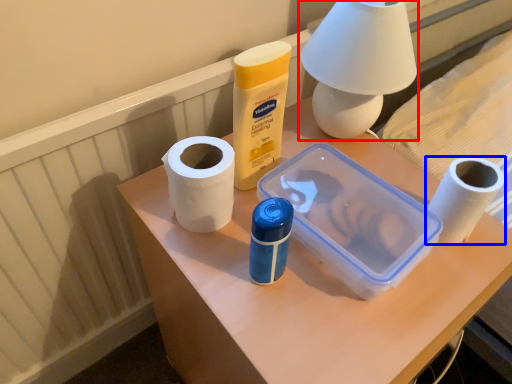
Question: Which object is closer to the camera taking this photo, table lamp (highlighted by a red box) or toilet paper (highlighted by a blue box)?

Choices:
 (A) table lamp
 (B) toilet paper

Answer: (A)